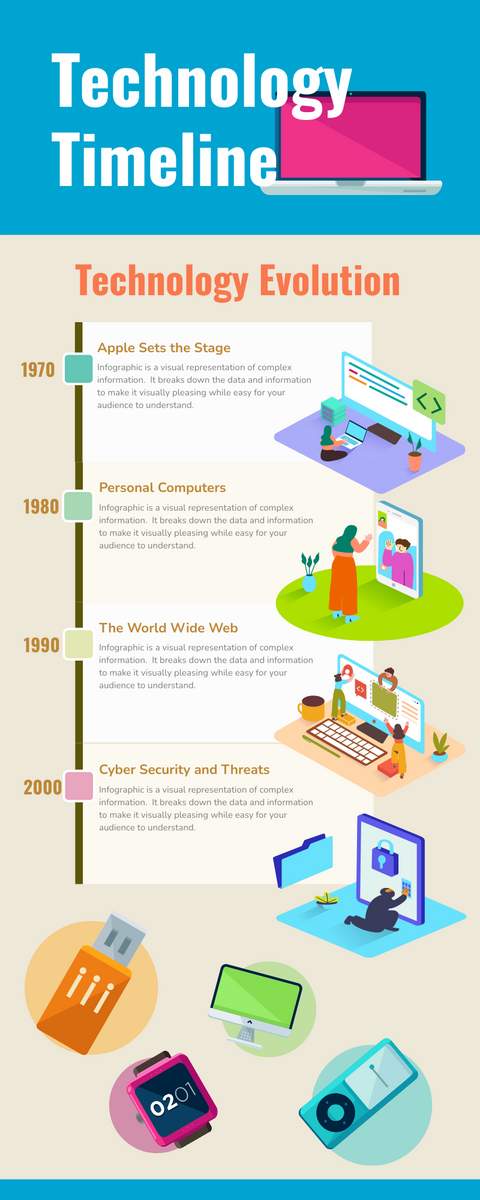
The image size is (480, 1200). In order to click on screen in this screenshot , I will do `click(186, 1082)`.